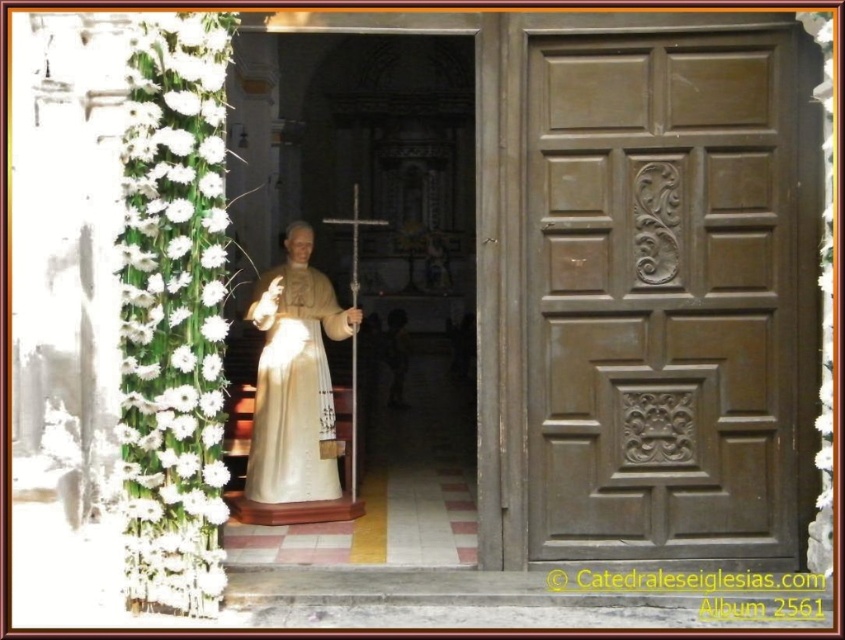
Question: Which of the following is the closest to the observer?

Choices:
 (A) (255, 449)
 (B) (352, 234)

Answer: (A)

Question: Which of the following is the farthest from the observer?

Choices:
 (A) (788, 112)
 (B) (254, 316)
 (C) (355, 212)

Answer: (C)

Question: Which point appears closest to the camera in this image?

Choices:
 (A) (356, 451)
 (B) (293, 497)
 (C) (687, 252)

Answer: (C)

Question: Can you confirm if brown carved wood door at right is wider than matte gold robe at center?

Choices:
 (A) no
 (B) yes

Answer: (B)

Question: Does brown carved wood door at right have a smaller size compared to matte gold robe at center?

Choices:
 (A) no
 (B) yes

Answer: (B)

Question: Does matte gold robe at center have a lesser width compared to metallic silver crucifix at center?

Choices:
 (A) no
 (B) yes

Answer: (B)